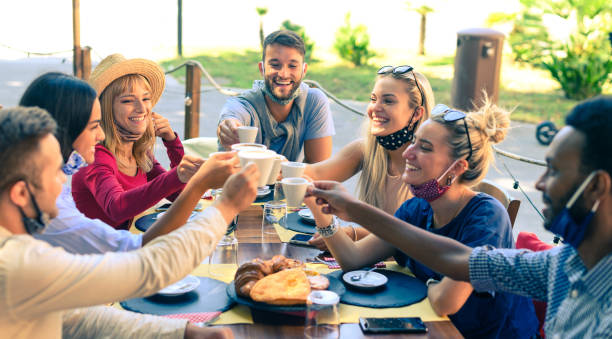
Locate an element on the screen. mugs is located at coordinates pos(242,134), pos(243,150), pos(259,162), pos(278,169), pos(293,171), pos(296,185).